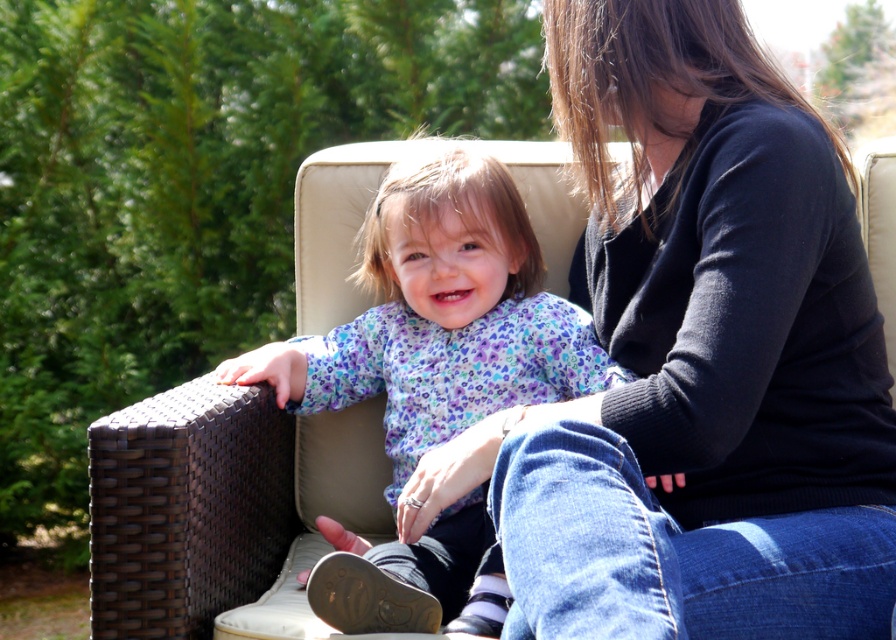
You are designing a new clothing line and need to compare the thickness of two items. You have a black sweater at upper right and a purple floral shirt at center. Which item is thinner?

The black sweater at upper right is thinner than the purple floral shirt at center according to the description.

You are standing in front of the wicker chair with a beige cushion where the adult and child are sitting. You want to place a small gift exactly halfway between the two points marked as point (700, 531) and point (481, 160). Will the gift be closer to the adult or the child?

The gift placed halfway between point (700, 531) and point (481, 160) will be closer to the adult because point (700, 531) is closer to the viewer than point (481, 160), meaning the midpoint leans towards the adult.

You are a photographer trying to capture a closeup shot of the black sweater at upper right and the purple floral shirt at center. The camera you are using has a minimum focus distance of 12 inches. Can you focus on both objects at the same time?

The black sweater at upper right and purple floral shirt at center are 12.95 inches apart. Since the minimum focus distance is 12 inches, the camera can focus on both objects simultaneously because the distance between them is within the camera range.